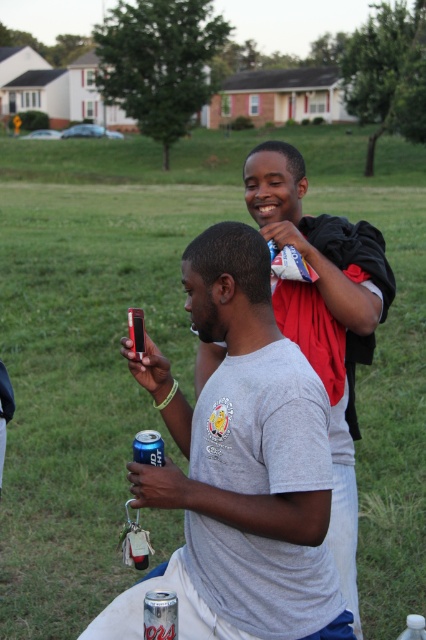
Can you confirm if matte black phone at center is shorter than blue metallic can at lower center?

No, matte black phone at center is not shorter than blue metallic can at lower center.

Is matte black phone at center to the right of blue metallic can at lower center from the viewer's perspective?

Indeed, matte black phone at center is positioned on the right side of blue metallic can at lower center.

Where is `matte black phone at center`? matte black phone at center is located at coordinates (244, 470).

Is point (282, 596) positioned before point (419, 634)?

Yes, it is in front of point (419, 634).

Does matte black phone at center have a lesser width compared to clear plastic bottle at center?

In fact, matte black phone at center might be wider than clear plastic bottle at center.

You are a GUI agent. You are given a task and a screenshot of the screen. Output one action in this format:
    pyautogui.click(x=<x>, y=<y>)
    Task: Click on the matte black phone at center
    
    Given the screenshot: What is the action you would take?
    244,470

Is blue metallic can at lower center to the left of clear plastic bottle at center from the viewer's perspective?

Correct, you'll find blue metallic can at lower center to the left of clear plastic bottle at center.

Who is more distant from viewer, (x=141, y=461) or (x=411, y=614)?

The point (x=411, y=614) is behind.

Locate an element on the screen. Image resolution: width=426 pixels, height=640 pixels. blue metallic can at lower center is located at coordinates (149, 448).